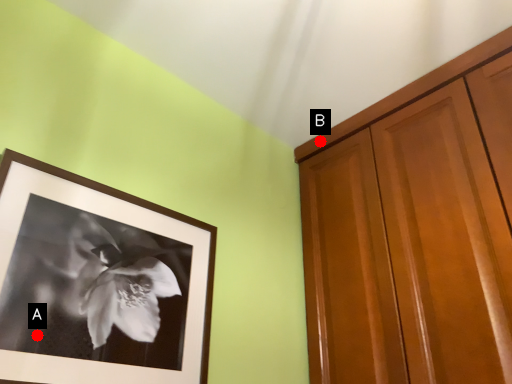
Question: Two points are circled on the image, labeled by A and B beside each circle. Which of the following is the farthest from the observer?

Choices:
 (A) A is further
 (B) B is further

Answer: (B)